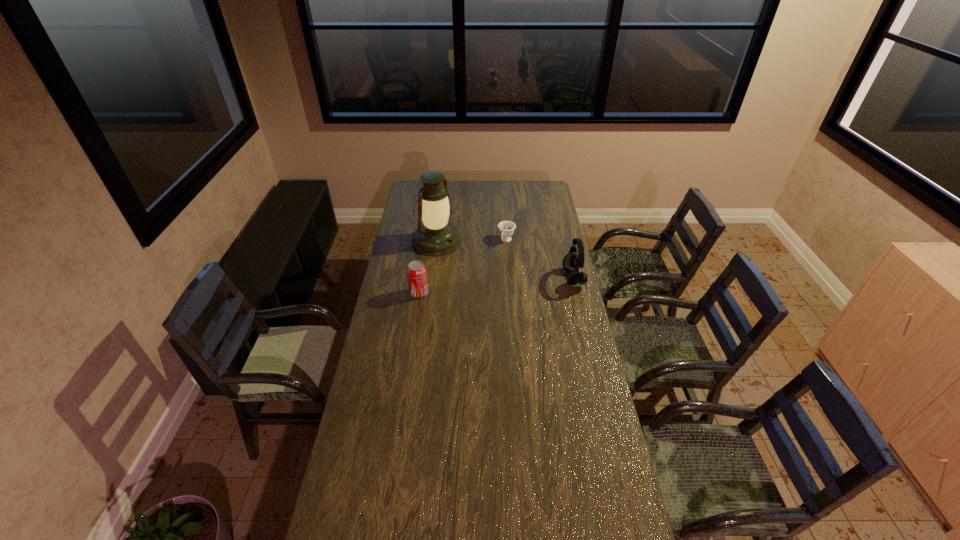
Where is `object at the right edge`? This screenshot has width=960, height=540. object at the right edge is located at coordinates [x=573, y=263].

At what (x,y) coordinates should I click in order to perform the action: click on vacant space at the far edge of the desktop. Please return your answer as a coordinate pair (x, y). The width and height of the screenshot is (960, 540). Looking at the image, I should click on pyautogui.click(x=494, y=184).

In the image, there is a desktop. Where is `free space at the near edge`? The image size is (960, 540). free space at the near edge is located at coordinates (489, 538).

In the image, there is a desktop. Where is `vacant region at the left edge`? The height and width of the screenshot is (540, 960). vacant region at the left edge is located at coordinates (381, 366).

Where is `vacant space at the right edge of the desktop`? vacant space at the right edge of the desktop is located at coordinates (558, 289).

Find the location of a particular element. The height and width of the screenshot is (540, 960). vacant area at the far right corner is located at coordinates (553, 195).

The height and width of the screenshot is (540, 960). What are the coordinates of `empty location between the soda can and the teacup` in the screenshot? It's located at (463, 267).

This screenshot has width=960, height=540. In order to click on free space between the shortest object and the soda can in this screenshot , I will do `click(463, 267)`.

The height and width of the screenshot is (540, 960). I want to click on vacant point located between the soda can and the shortest object, so click(x=463, y=267).

Where is `vacant space that's between the lantern and the soda can`? vacant space that's between the lantern and the soda can is located at coordinates (428, 267).